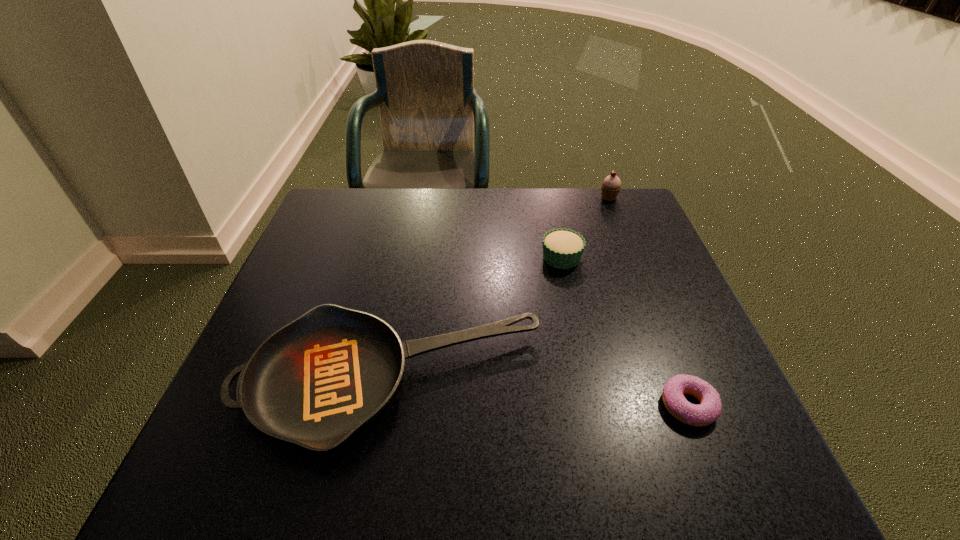
Where is `the farther cupcake`? the farther cupcake is located at coordinates (611, 185).

Find the location of a particular element. The image size is (960, 540). the right cupcake is located at coordinates (611, 185).

You are a GUI agent. You are given a task and a screenshot of the screen. Output one action in this format:
    pyautogui.click(x=<x>, y=<y>)
    Task: Click on the second farthest object
    This screenshot has height=540, width=960.
    Given the screenshot: What is the action you would take?
    pyautogui.click(x=562, y=248)

Locate an element on the screen. the nearer cupcake is located at coordinates (562, 248).

Where is `frying pan`? frying pan is located at coordinates (322, 377).

At what (x,y) coordinates should I click in order to perform the action: click on the third tallest object. Please return your answer as a coordinate pair (x, y). Looking at the image, I should click on (322, 377).

Where is `doughnut`? doughnut is located at coordinates (709, 409).

You are a GUI agent. You are given a task and a screenshot of the screen. Output one action in this format:
    pyautogui.click(x=<x>, y=<y>)
    Task: Click on the blank area located on the front of the taller cupcake
    
    Given the screenshot: What is the action you would take?
    pyautogui.click(x=631, y=252)

Identify the location of vacant space located on the front of the third object from right to left. (594, 410).

Where is `free space located 0.400m on the back of the second shortest object`? This screenshot has width=960, height=540. free space located 0.400m on the back of the second shortest object is located at coordinates tap(420, 214).